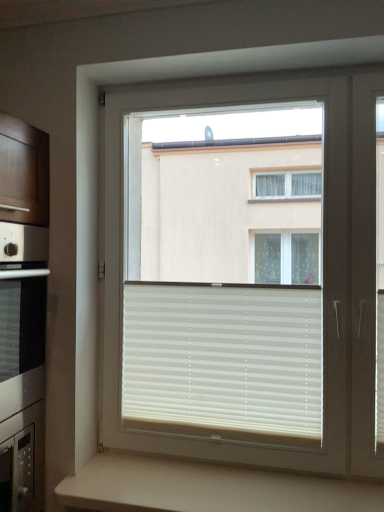
Question: Is beige matte counter at lower center not within white plastic window at center?

Choices:
 (A) no
 (B) yes

Answer: (B)

Question: Would you say beige matte counter at lower center is a long distance from white plastic window at center?

Choices:
 (A) no
 (B) yes

Answer: (B)

Question: Is white plastic window at center at the back of beige matte counter at lower center?

Choices:
 (A) yes
 (B) no

Answer: (B)

Question: Can you confirm if beige matte counter at lower center is wider than white plastic window at center?

Choices:
 (A) yes
 (B) no

Answer: (A)

Question: Could you tell me if beige matte counter at lower center is facing white plastic window at center?

Choices:
 (A) no
 (B) yes

Answer: (A)

Question: Considering the relative positions of beige matte counter at lower center and white plastic window at center in the image provided, is beige matte counter at lower center to the right of white plastic window at center from the viewer's perspective?

Choices:
 (A) no
 (B) yes

Answer: (A)

Question: Is white matte blinds at center behind beige matte counter at lower center?

Choices:
 (A) no
 (B) yes

Answer: (B)

Question: Considering the relative sizes of white matte blinds at center and beige matte counter at lower center in the image provided, is white matte blinds at center shorter than beige matte counter at lower center?

Choices:
 (A) yes
 (B) no

Answer: (B)

Question: From the image's perspective, is white matte blinds at center below beige matte counter at lower center?

Choices:
 (A) yes
 (B) no

Answer: (B)

Question: From a real-world perspective, is white matte blinds at center physically above beige matte counter at lower center?

Choices:
 (A) no
 (B) yes

Answer: (B)

Question: Is white matte blinds at center facing towards beige matte counter at lower center?

Choices:
 (A) no
 (B) yes

Answer: (A)

Question: Is white matte blinds at center with beige matte counter at lower center?

Choices:
 (A) yes
 (B) no

Answer: (B)

Question: From the image's perspective, is white matte blinds at center on white plastic window at center?

Choices:
 (A) no
 (B) yes

Answer: (A)